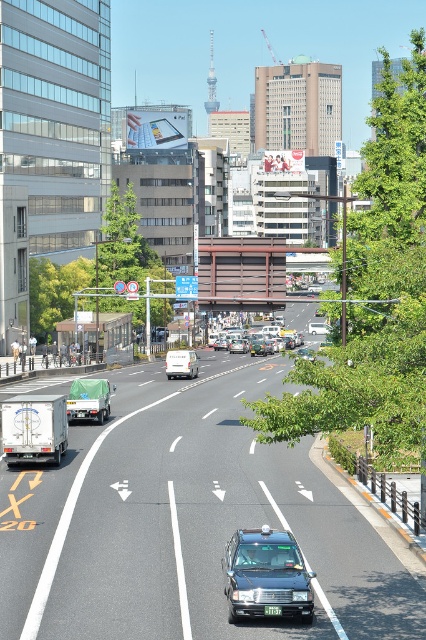
You are a delivery driver who needs to reach a point located at coordinates point (222, 342) as quickly as possible. The black taxi in the center lane is blocking your path. Can you safely detour around it without violating traffic rules?

The point (222, 342) is 110.15 meters away from you. Since the black taxi in the center lane is blocking your path, you can safely detour around it by moving to the right lane if it is clear of oncoming traffic, ensuring you follow traffic signals and maintain a safe distance. Alternatively, if the left lane is accessible and safe, you could also maneuver there while adhering to traffic rules.

You are a driver in a car that is exactly 4 meters long. You want to park your car in the space between the metallic silver sedan at center and the green plastic license plate at center. Is there enough space to park your car without overlapping either vehicle?

The metallic silver sedan at center is 90.44 meters away from the green plastic license plate at center. Since your car is only 4 meters long, there is more than enough space between them to park without overlapping either vehicle.